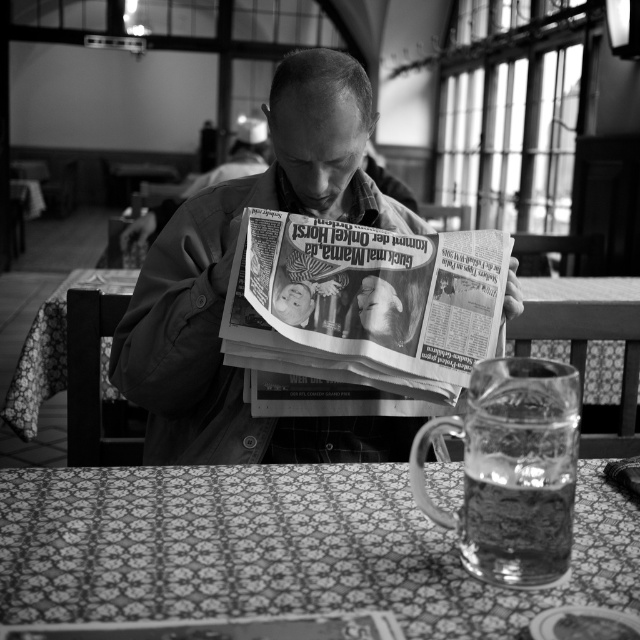
Question: Is patterned fabric table at lower center smaller than matte newspaper at center?

Choices:
 (A) yes
 (B) no

Answer: (A)

Question: Can you confirm if patterned fabric table at lower center is thinner than matte newspaper at center?

Choices:
 (A) yes
 (B) no

Answer: (B)

Question: Is matte newspaper at center to the left of printed newspaper at center from the viewer's perspective?

Choices:
 (A) yes
 (B) no

Answer: (A)

Question: Among these objects, which one is farthest from the camera?

Choices:
 (A) matte newspaper at center
 (B) patterned fabric table at lower center
 (C) printed newspaper at center

Answer: (A)

Question: Among these objects, which one is nearest to the camera?

Choices:
 (A) matte newspaper at center
 (B) patterned fabric table at lower center
 (C) printed newspaper at center

Answer: (B)

Question: Which point is closer to the camera taking this photo?

Choices:
 (A) (273, 284)
 (B) (234, 593)

Answer: (B)